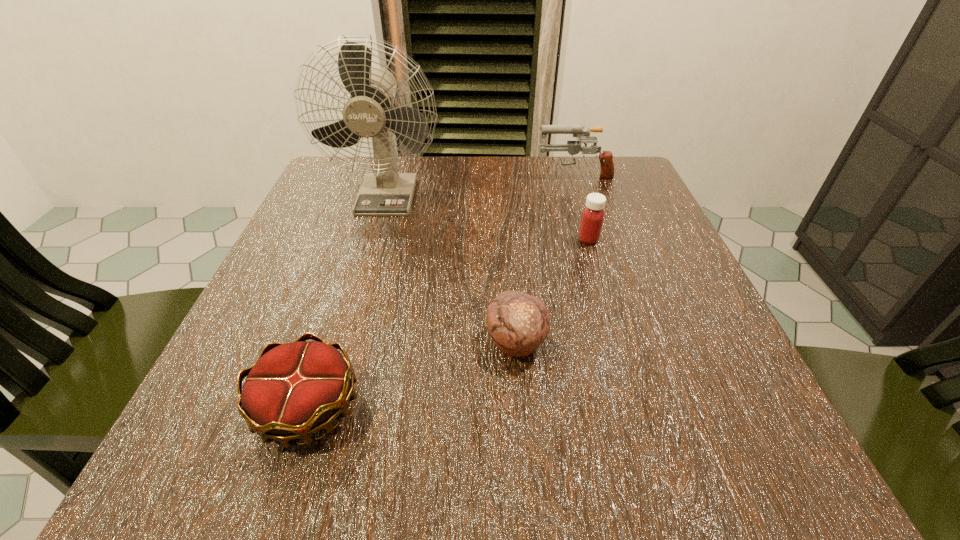
Where is `vacant region located 0.100m on the right of the muffin`? Image resolution: width=960 pixels, height=540 pixels. vacant region located 0.100m on the right of the muffin is located at coordinates tap(614, 342).

You are a GUI agent. You are given a task and a screenshot of the screen. Output one action in this format:
    pyautogui.click(x=<x>, y=<y>)
    Task: Click on the free location located 0.400m on the back of the crown
    
    Given the screenshot: What is the action you would take?
    pyautogui.click(x=372, y=208)

The height and width of the screenshot is (540, 960). I want to click on fan that is at the far edge, so click(370, 112).

Where is `gun at the far edge`? gun at the far edge is located at coordinates (573, 147).

I want to click on object that is at the near edge, so coord(296,389).

Find the location of a particular element. fan positioned at the left edge is located at coordinates (370, 112).

Locate an element on the screen. crown present at the left edge is located at coordinates (296, 389).

At what (x,y) coordinates should I click in order to perform the action: click on gun that is at the right edge. Please return your answer as a coordinate pair (x, y). This screenshot has height=540, width=960. Looking at the image, I should click on (573, 147).

Where is `medicine present at the right edge`? This screenshot has height=540, width=960. medicine present at the right edge is located at coordinates (592, 218).

Where is `object that is at the far left corner`? The height and width of the screenshot is (540, 960). object that is at the far left corner is located at coordinates (370, 112).